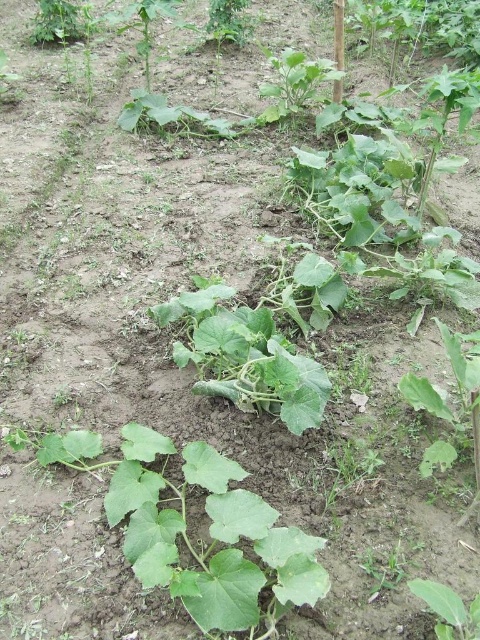
Question: Does green matte leafy plant at center appear under green leafy plant at upper center?

Choices:
 (A) no
 (B) yes

Answer: (B)

Question: Which object is closer to the camera taking this photo?

Choices:
 (A) green leafy plant at lower right
 (B) green leafy plant at upper center
 (C) green leafy plant at lower center

Answer: (A)

Question: Which point is closer to the camera?

Choices:
 (A) (286, 547)
 (B) (396, 557)
 (C) (428, 605)
 (D) (277, 58)

Answer: (A)

Question: Does green leafy plant at lower right have a larger size compared to green leafy plant at lower center?

Choices:
 (A) yes
 (B) no

Answer: (A)

Question: Observing the image, what is the correct spatial positioning of green matte leafy plant at center in reference to green leafy plant at lower center?

Choices:
 (A) right
 (B) left

Answer: (B)

Question: Which object appears closest to the camera in this image?

Choices:
 (A) green matte leafy plant at center
 (B) green leafy plant at upper center
 (C) green leafy plant at lower center
 (D) green leafy plant at lower right

Answer: (D)